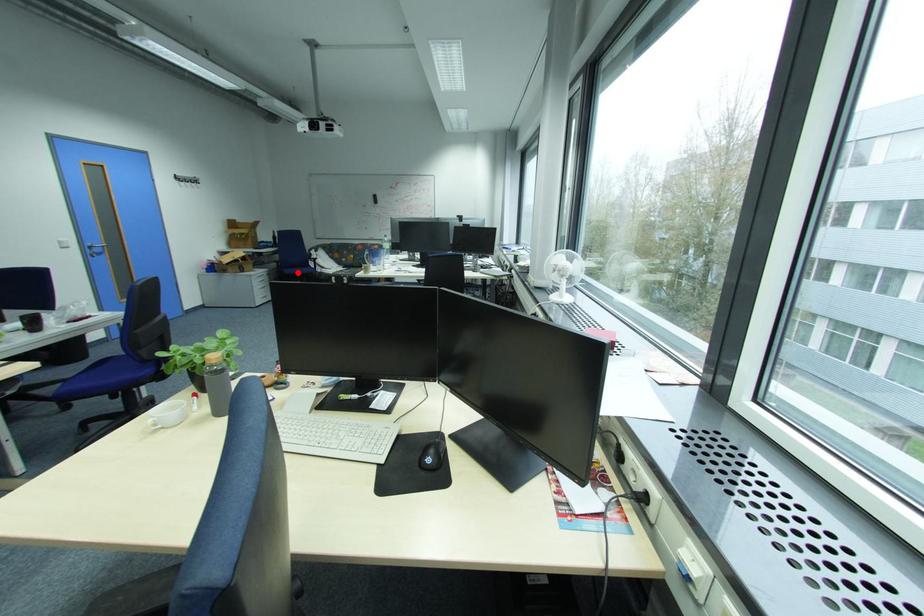
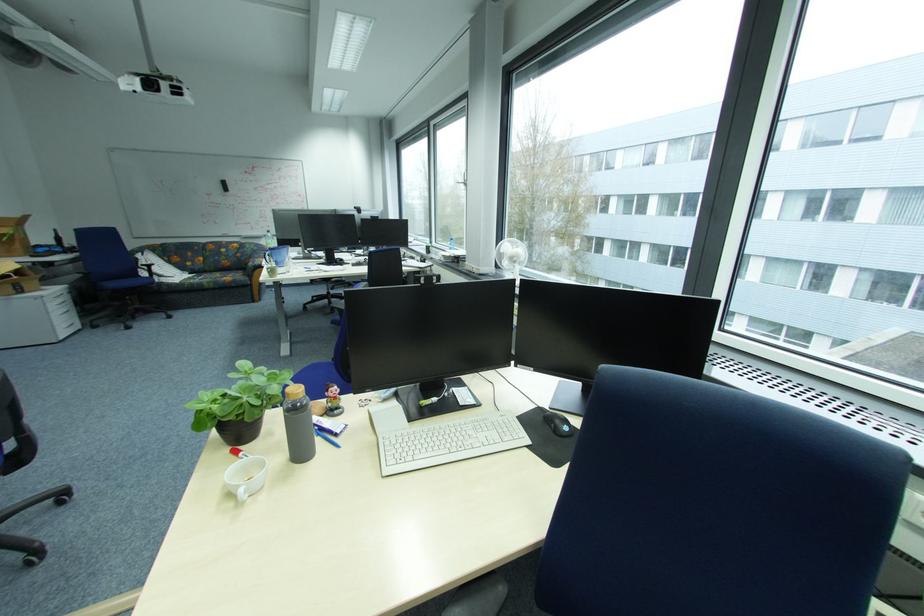
Question: I am providing you with two images of the same scene from different viewpoints. A red point is shown in image1. For the corresponding object point in image2, is it positioned nearer or farther from the camera?

Choices:
 (A) Nearer
 (B) Farther

Answer: (B)